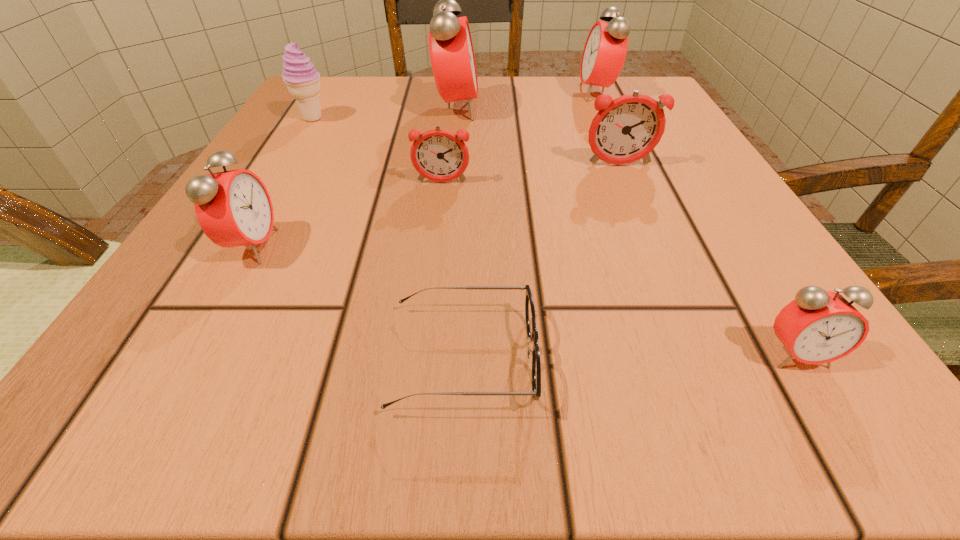
You are a GUI agent. You are given a task and a screenshot of the screen. Output one action in this format:
    pyautogui.click(x=<x>, y=<y>)
    Task: Click on the vacant region located on the front-facing side of the farther reddish-pink alarm clock
    
    Given the screenshot: What is the action you would take?
    pyautogui.click(x=700, y=358)

Image resolution: width=960 pixels, height=540 pixels. What are the coordinates of `vacant space situated on the front-facing side of the leftmost alarm clock` in the screenshot? It's located at (561, 246).

Image resolution: width=960 pixels, height=540 pixels. In order to click on free space located 0.240m on the front-facing side of the fourth nearest object in this screenshot , I will do `click(428, 305)`.

Locate an element on the screen. This screenshot has width=960, height=540. vacant space situated through the lenses of the spectacles is located at coordinates (839, 359).

Where is `icecream that is at the far edge`? icecream that is at the far edge is located at coordinates (302, 80).

I want to click on alarm clock that is at the near edge, so click(x=819, y=326).

Identify the location of spectacles at the near edge. (532, 332).

The image size is (960, 540). I want to click on icecream located at the left edge, so 302,80.

Find the location of a particular element. alarm clock that is positioned at the left edge is located at coordinates (233, 208).

This screenshot has width=960, height=540. What are the coordinates of `object that is at the far left corner` in the screenshot? It's located at (302, 80).